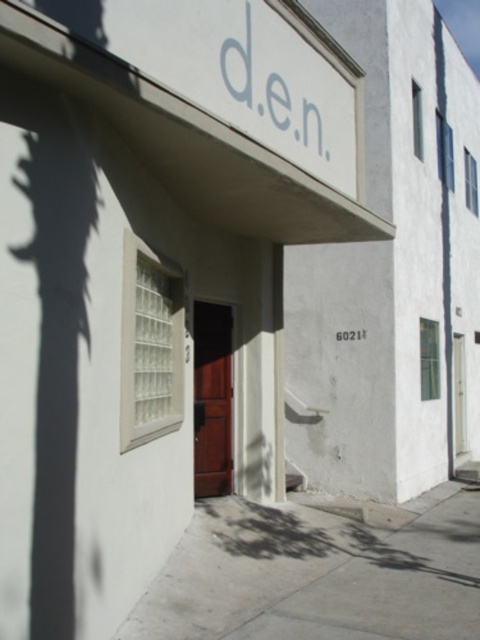
Question: Which point is farther from the camera taking this photo?

Choices:
 (A) (340, 573)
 (B) (203, 308)

Answer: (B)

Question: Does gray concrete pavement at center have a larger size compared to brown wooden door at center?

Choices:
 (A) no
 (B) yes

Answer: (B)

Question: Which object is farther from the camera taking this photo?

Choices:
 (A) brown wooden door at center
 (B) gray concrete pavement at center

Answer: (A)

Question: Which point is farther to the camera?

Choices:
 (A) (340, 595)
 (B) (227, 394)

Answer: (B)

Question: Can you confirm if gray concrete pavement at center is thinner than brown wooden door at center?

Choices:
 (A) no
 (B) yes

Answer: (A)

Question: Is gray concrete pavement at center below brown wooden door at center?

Choices:
 (A) yes
 (B) no

Answer: (A)